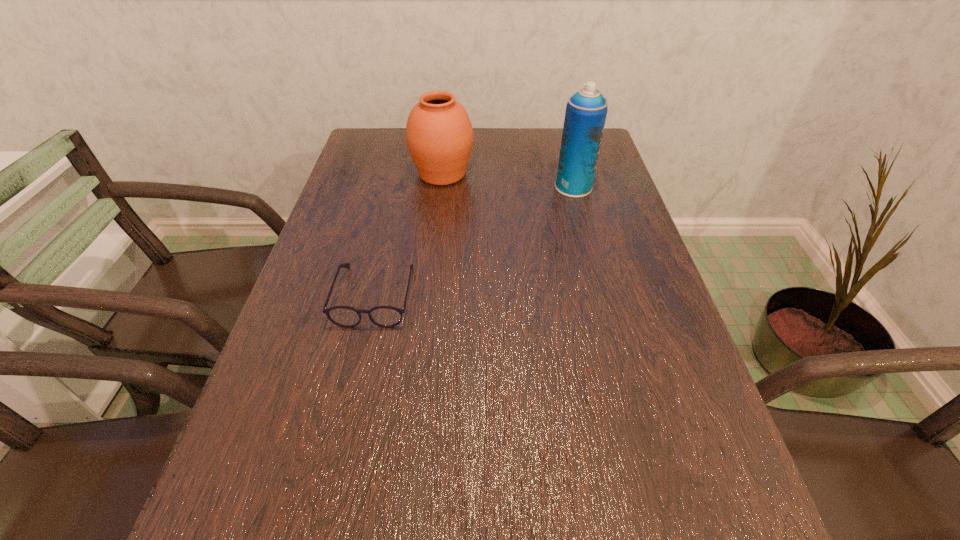
Identify the location of object that is positioned at the right edge. (586, 110).

The height and width of the screenshot is (540, 960). What are the coordinates of `vacant space at the far edge of the desktop` in the screenshot? It's located at (496, 163).

Find the location of a particular element. vacant space at the left edge is located at coordinates (219, 499).

Where is `vacant space at the right edge of the desktop`? The height and width of the screenshot is (540, 960). vacant space at the right edge of the desktop is located at coordinates (642, 243).

Locate an element on the screen. unoccupied position between the urn and the spectacles is located at coordinates (409, 234).

Where is `free spot between the second shortest object and the shortest object`? free spot between the second shortest object and the shortest object is located at coordinates (409, 234).

The image size is (960, 540). Identify the location of empty space between the tallest object and the second shortest object. (508, 180).

Identify the location of vacant space that's between the urn and the shortest object. (409, 234).

Where is `free area in between the shortest object and the second tallest object`? This screenshot has width=960, height=540. free area in between the shortest object and the second tallest object is located at coordinates (409, 234).

Locate an element on the screen. The image size is (960, 540). vacant region between the spectacles and the aerosol can is located at coordinates (474, 241).